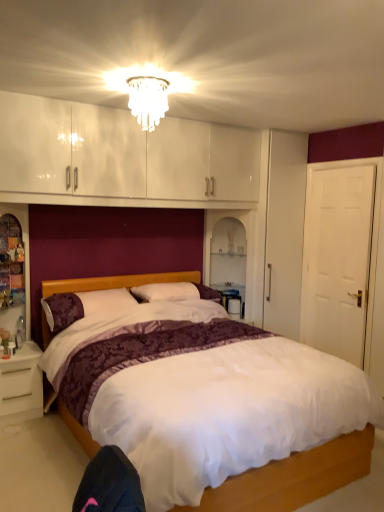
The width and height of the screenshot is (384, 512). In order to click on blank space situated above white matte door at right (from a real-world perspective) in this screenshot , I will do `click(342, 167)`.